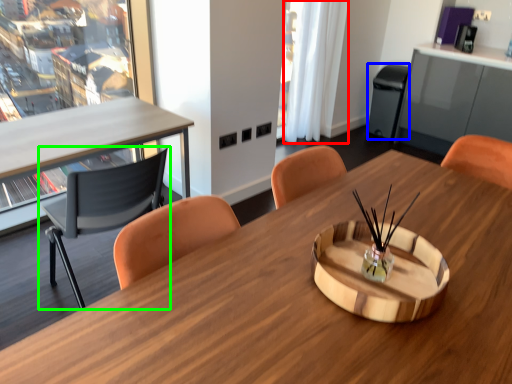
Question: Which object is the farthest from curtain (highlighted by a red box)? Choose among these: trash bin/can (highlighted by a blue box) or chair (highlighted by a green box).

Choices:
 (A) trash bin/can
 (B) chair

Answer: (B)